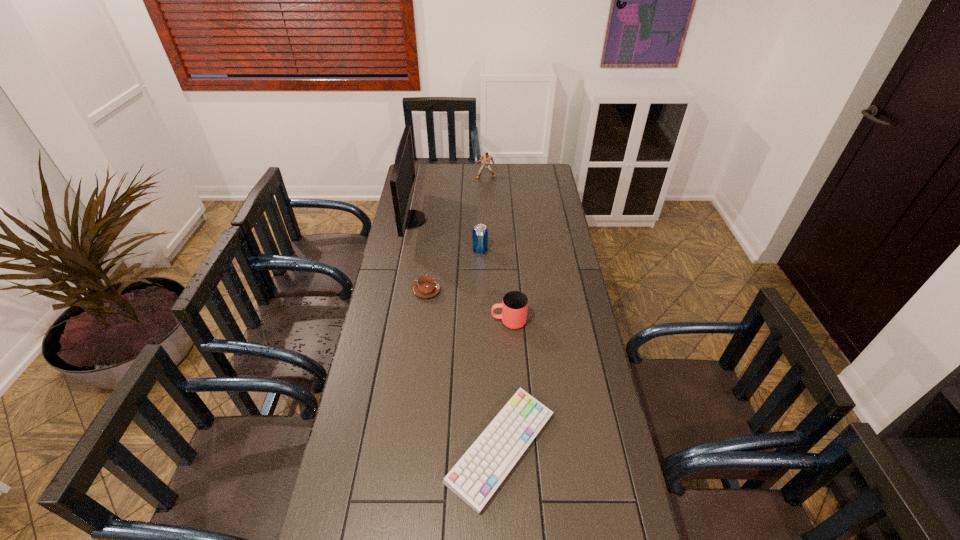
In the image, there is a desktop. Where is `vacant region at the left edge`? The height and width of the screenshot is (540, 960). vacant region at the left edge is located at coordinates (348, 527).

Locate an element on the screen. This screenshot has width=960, height=540. blank area at the right edge is located at coordinates point(546,325).

Find the location of a particular element. This screenshot has width=960, height=540. free region at the far right corner of the desktop is located at coordinates (533, 176).

I want to click on vacant space that's between the farthest object and the fifth farthest object, so click(x=497, y=249).

Identify the location of blank region between the computer monitor and the fifth farthest object. (460, 271).

The height and width of the screenshot is (540, 960). In order to click on empty location between the farthest object and the cup in this screenshot , I will do `click(497, 249)`.

The height and width of the screenshot is (540, 960). Identify the location of free space that is in between the computer keyboard and the second nearest object. (505, 385).

Locate an element on the screen. free area in between the fourth farthest object and the computer keyboard is located at coordinates (464, 369).

Where is `vacant area that lies between the cup and the beer can`? This screenshot has height=540, width=960. vacant area that lies between the cup and the beer can is located at coordinates (494, 286).

The width and height of the screenshot is (960, 540). I want to click on free spot between the farthest object and the fourth farthest object, so click(456, 234).